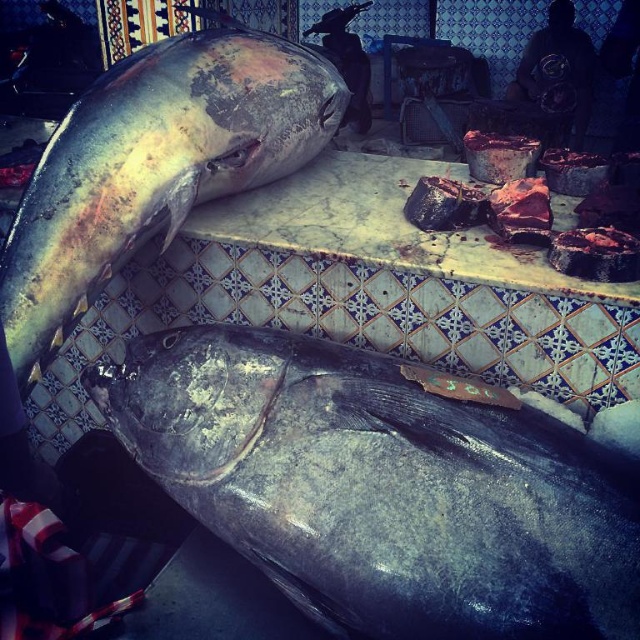
Question: Which point is farther to the camera?

Choices:
 (A) (276, 346)
 (B) (49, 195)

Answer: (B)

Question: Is shiny dark gray fish at center below shiny silver fish at center?

Choices:
 (A) no
 (B) yes

Answer: (B)

Question: Can you confirm if shiny dark gray fish at center is thinner than shiny silver fish at center?

Choices:
 (A) yes
 (B) no

Answer: (B)

Question: Among these objects, which one is nearest to the camera?

Choices:
 (A) shiny dark gray fish at center
 (B) shiny silver fish at center

Answer: (A)

Question: Can you confirm if shiny dark gray fish at center is positioned to the right of shiny silver fish at center?

Choices:
 (A) yes
 (B) no

Answer: (A)